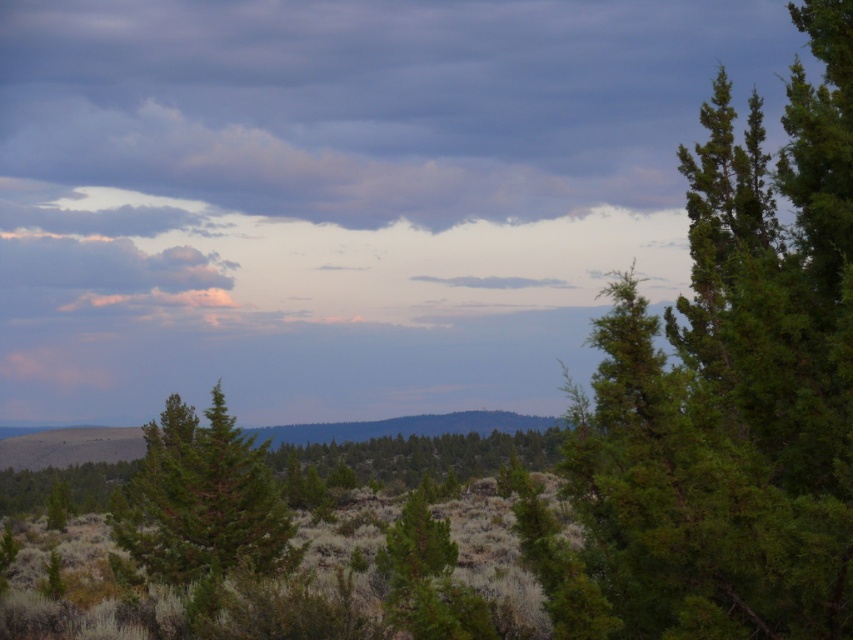
Question: Does green textured tree at right appear on the right side of green matte tree at center?

Choices:
 (A) yes
 (B) no

Answer: (A)

Question: Which object is farther from the camera taking this photo?

Choices:
 (A) green matte tree at center
 (B) pink fluffy cloud at upper left

Answer: (B)

Question: Which point is farther to the camera?

Choices:
 (A) (444, 173)
 (B) (216, 381)
 (C) (711, 188)

Answer: (A)

Question: Is cloudy sky at upper center wider than green textured tree at center?

Choices:
 (A) yes
 (B) no

Answer: (A)

Question: Which of these objects is positioned closest to the green textured tree at right?

Choices:
 (A) pink fluffy cloud at upper left
 (B) cloudy sky at upper center
 (C) green matte tree at center

Answer: (C)

Question: Can you confirm if green matte tree at center is positioned below pink fluffy cloud at upper left?

Choices:
 (A) yes
 (B) no

Answer: (A)